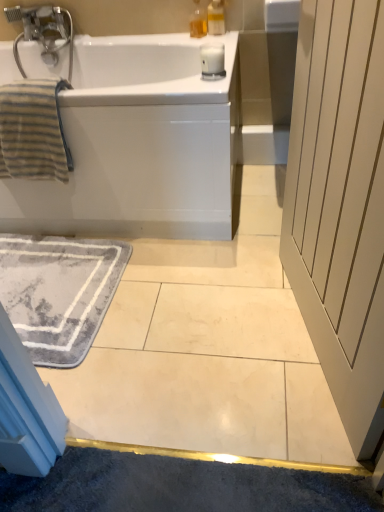
Question: Considering their positions, is white glossy bathtub at upper left located in front of or behind gray soft rug at lower left?

Choices:
 (A) behind
 (B) front

Answer: (A)

Question: In terms of width, does white glossy bathtub at upper left look wider or thinner when compared to gray soft rug at lower left?

Choices:
 (A) thin
 (B) wide

Answer: (B)

Question: Estimate the real-world distances between objects in this image. Which object is closer to the translucent plastic soap dispenser at upper center, which is counted as the second soap dispenser, starting from the left?

Choices:
 (A) striped cotton towel at left
 (B) gray soft rug at lower left
 (C) translucent plastic soap dispenser at upper center, the 1th soap dispenser viewed from the left
 (D) white glossy bathtub at upper left
 (E) white wood screen door at right

Answer: (C)

Question: Which object is the farthest from the white wood screen door at right?

Choices:
 (A) gray soft rug at lower left
 (B) translucent plastic soap dispenser at upper center, which is counted as the second soap dispenser, starting from the left
 (C) white glossy bathtub at upper left
 (D) translucent plastic soap dispenser at upper center, which is counted as the 2th soap dispenser, starting from the right
 (E) striped cotton towel at left

Answer: (D)